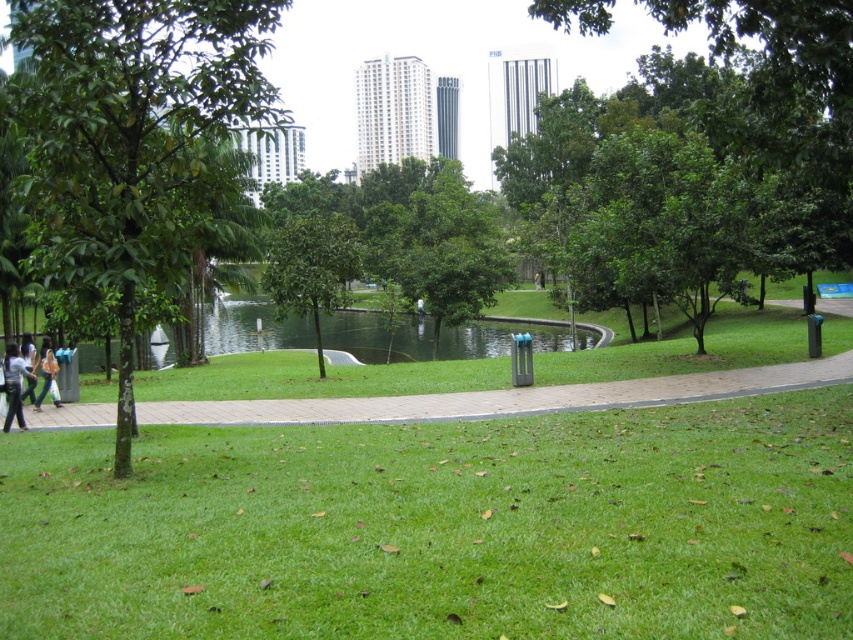
Who is taller, green leafy tree at left or light blue shirt at lower left?

green leafy tree at left is taller.

Looking at this image, between green leafy tree at left and light blue shirt at lower left, which one appears on the left side from the viewer's perspective?

green leafy tree at left is more to the left.

This screenshot has width=853, height=640. I want to click on green leafy tree at left, so click(136, 140).

Does green grassy at center have a larger size compared to light blue shirt at lower left?

Yes, green grassy at center is bigger than light blue shirt at lower left.

Which is above, green grassy at center or light blue shirt at lower left?

Positioned higher is light blue shirt at lower left.

Is point (805, 632) more distant than point (4, 364)?

No, it is not.

Find the location of a particular element. This screenshot has width=853, height=640. green grassy at center is located at coordinates (440, 528).

Is green grassy at center above green leafy tree at left?

No, green grassy at center is not above green leafy tree at left.

Who is taller, green grassy at center or green leafy tree at left?

Standing taller between the two is green leafy tree at left.

Who is more forward, (x=838, y=481) or (x=206, y=116)?

Point (x=838, y=481) is in front.

You are a GUI agent. You are given a task and a screenshot of the screen. Output one action in this format:
    pyautogui.click(x=<x>, y=<y>)
    Task: Click on the green grassy at center
    
    Given the screenshot: What is the action you would take?
    pyautogui.click(x=440, y=528)